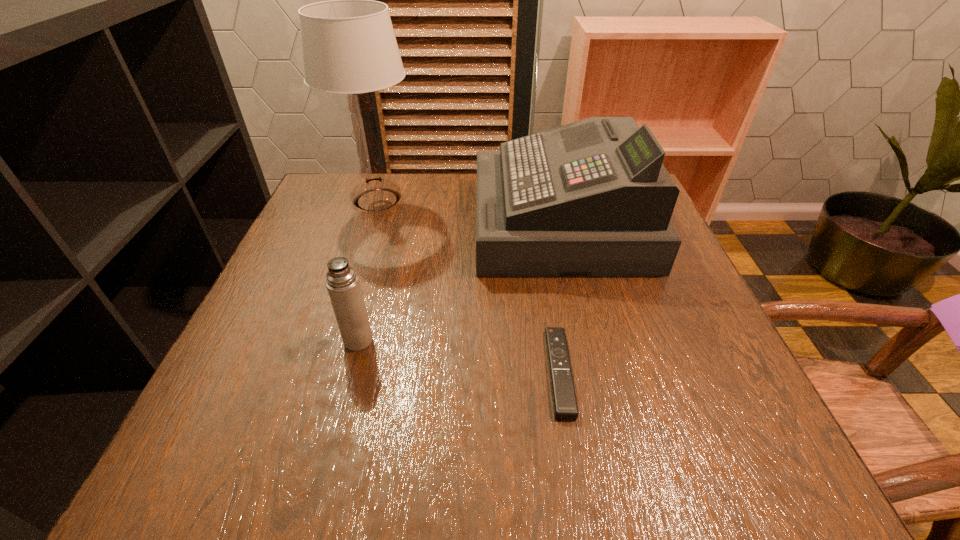
At what (x,y) coordinates should I click in order to perform the action: click on vacant space at the right edge of the desktop. Please return your answer as a coordinate pair (x, y). Image resolution: width=960 pixels, height=540 pixels. Looking at the image, I should click on (659, 411).

This screenshot has height=540, width=960. I want to click on blank area at the far left corner, so click(321, 194).

Locate an element on the screen. vacant space that is in between the third tallest object and the table lamp is located at coordinates (368, 270).

Where is `empty location between the thermos bottle and the shortest object`? Image resolution: width=960 pixels, height=540 pixels. empty location between the thermos bottle and the shortest object is located at coordinates (459, 356).

This screenshot has height=540, width=960. Identify the location of free space between the second tallest object and the tallest object. (468, 212).

This screenshot has height=540, width=960. In order to click on empty space that is in between the tallest object and the remote control in this screenshot , I will do `click(468, 286)`.

Locate an element on the screen. The image size is (960, 540). blank region between the remote control and the third shortest object is located at coordinates (560, 298).

Find the location of a particular element. This screenshot has width=960, height=540. vacant area that lies between the thermos bottle and the table lamp is located at coordinates (368, 270).

You are a GUI agent. You are given a task and a screenshot of the screen. Output one action in this format:
    pyautogui.click(x=<x>, y=<y>)
    Task: Click on the vacant space in between the second tallest object and the second shortest object
    Image resolution: width=960 pixels, height=540 pixels.
    Given the screenshot: What is the action you would take?
    pyautogui.click(x=459, y=281)

At what (x,y) coordinates should I click in order to perform the action: click on free space that is in between the cash register and the remote control. Please return your answer as a coordinate pair (x, y). Looking at the image, I should click on (560, 298).